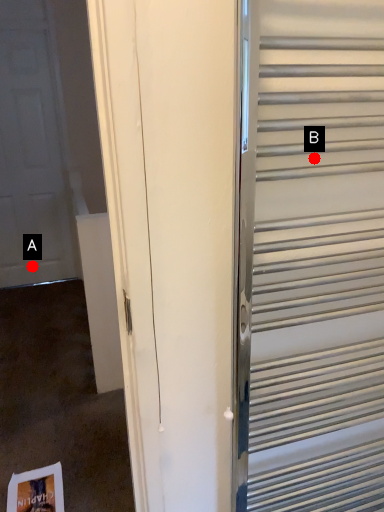
Question: Two points are circled on the image, labeled by A and B beside each circle. Which point is farther from the camera taking this photo?

Choices:
 (A) A is further
 (B) B is further

Answer: (A)